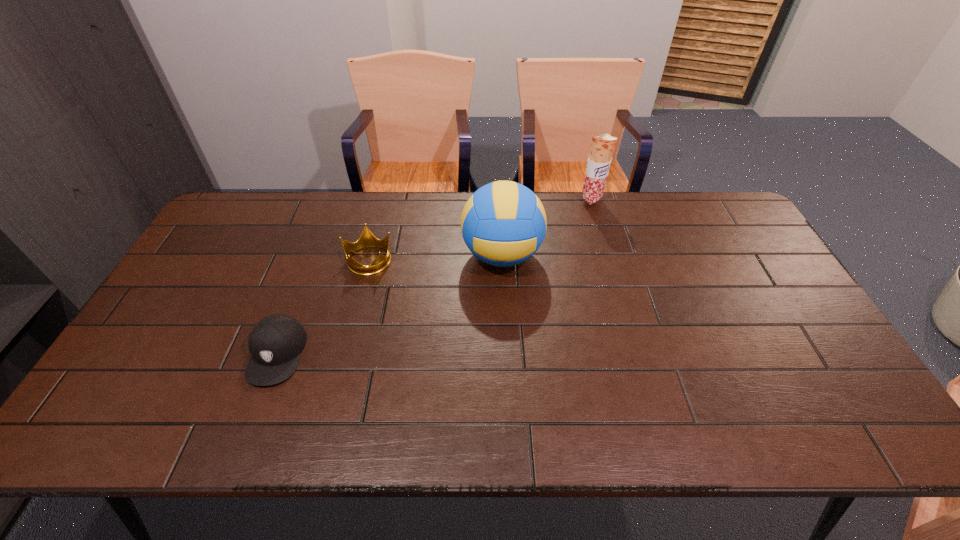
Find the location of a particular element. The width and height of the screenshot is (960, 540). free point between the leftmost object and the crown is located at coordinates (323, 307).

The height and width of the screenshot is (540, 960). I want to click on free space between the third object from right to left and the volleyball, so click(435, 258).

At what (x,y) coordinates should I click in order to perform the action: click on vacant point located between the cap and the farthest object. Please return your answer as a coordinate pair (x, y). Looking at the image, I should click on (434, 276).

In order to click on object that can be found as the second closest to the cap in this screenshot , I will do `click(503, 223)`.

Point out which object is positioned as the third nearest to the cap. Please provide its 2D coordinates. Your answer should be formatted as a tuple, i.e. [(x, y)], where the tuple contains the x and y coordinates of a point satisfying the conditions above.

[(602, 147)]